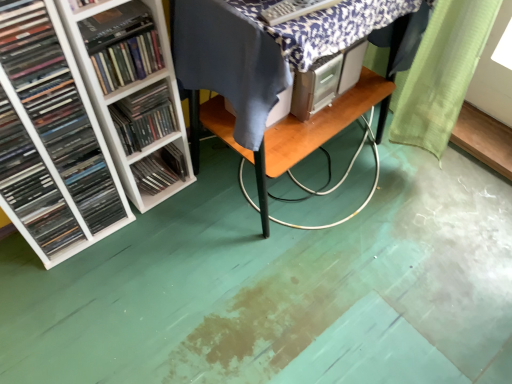
I want to click on vacant point to the right of white plastic shelf at left, marked as the second shelf in a front-to-back arrangement, so 201,183.